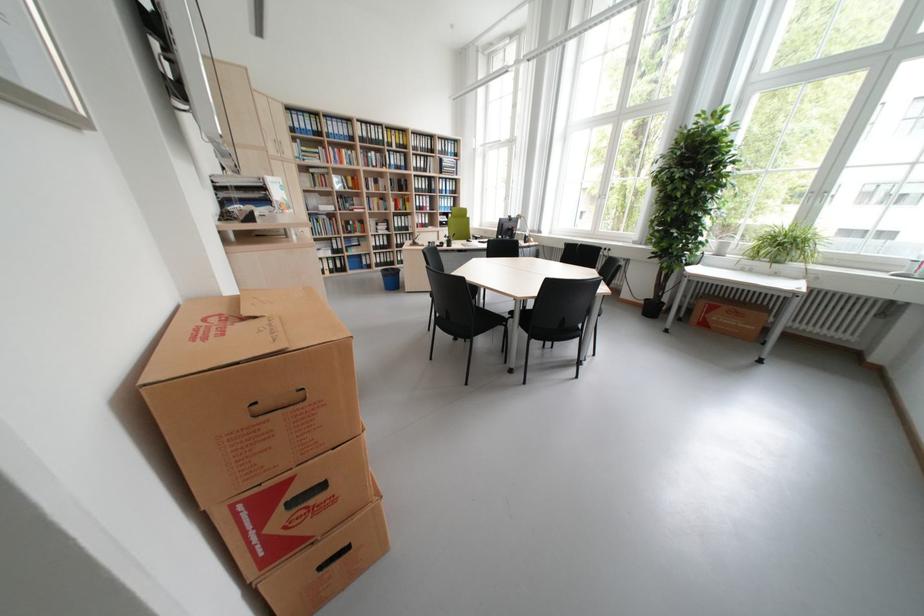
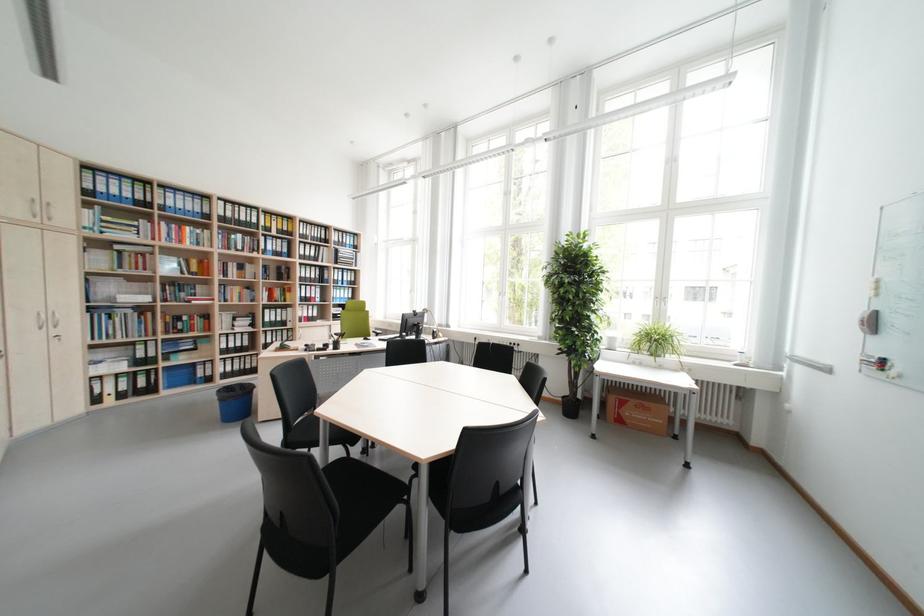
The images are taken continuously from a first-person perspective. In which direction is your viewpoint rotating?

The camera's rotation is toward right-up.